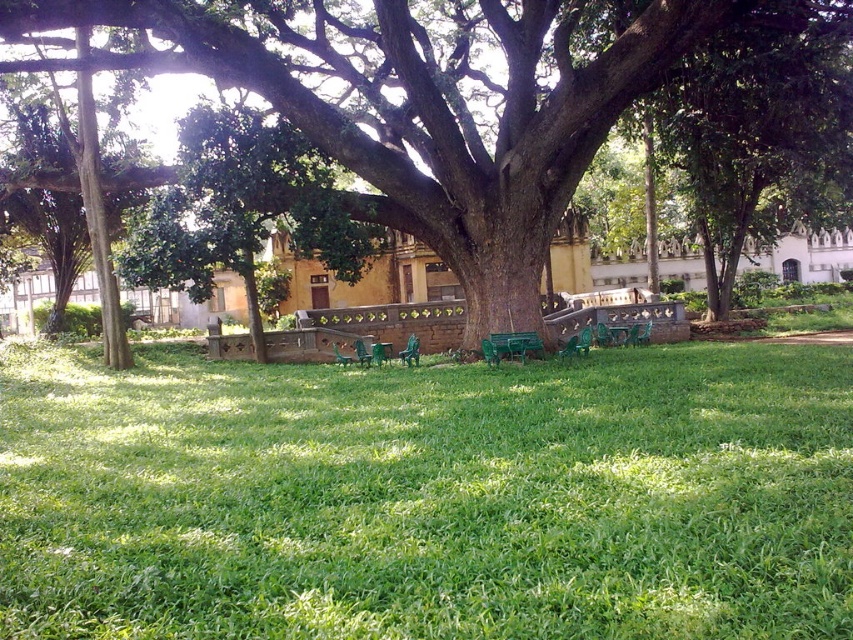
Question: Observing the image, what is the correct spatial positioning of green plastic bench at center in reference to green plastic chair at center?

Choices:
 (A) above
 (B) below

Answer: (A)

Question: Which object is the farthest from the green plastic bench at center?

Choices:
 (A) green grassy at center
 (B) green textured tree at center

Answer: (B)

Question: From the image, what is the correct spatial relationship of green textured tree at center in relation to green leafy tree at upper right?

Choices:
 (A) left
 (B) right

Answer: (A)

Question: Among these points, which one is farthest from the camera?

Choices:
 (A) (779, 221)
 (B) (426, 540)

Answer: (A)

Question: Is green textured tree at center thinner than green plastic chair at center?

Choices:
 (A) yes
 (B) no

Answer: (B)

Question: Which object appears closest to the camera in this image?

Choices:
 (A) green plastic chair at center
 (B) green grassy at center

Answer: (B)